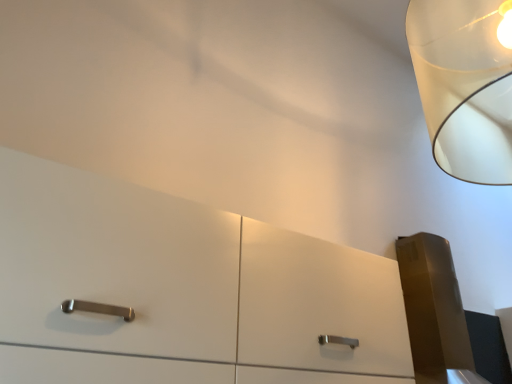
What do you see at coordinates (465, 84) in the screenshot? This screenshot has height=384, width=512. I see `transparent plastic lampshade at upper right` at bounding box center [465, 84].

Image resolution: width=512 pixels, height=384 pixels. I want to click on transparent plastic lampshade at upper right, so click(465, 84).

The image size is (512, 384). Describe the element at coordinates (181, 290) in the screenshot. I see `white glossy dresser at center` at that location.

Identify the location of white glossy dresser at center. The width and height of the screenshot is (512, 384). (181, 290).

I want to click on transparent plastic lampshade at upper right, so click(x=465, y=84).

Does transparent plastic lampshade at upper right appear on the right side of white glossy dresser at center?

Yes.

Relative to white glossy dresser at center, is transparent plastic lampshade at upper right in front or behind?

transparent plastic lampshade at upper right is behind white glossy dresser at center.

Considering the points (426, 74) and (5, 275), which point is behind, point (426, 74) or point (5, 275)?

The point (426, 74) is behind.

From the image's perspective, between transparent plastic lampshade at upper right and white glossy dresser at center, who is located below?

From the image's view, white glossy dresser at center is below.

From a real-world perspective, between transparent plastic lampshade at upper right and white glossy dresser at center, who is vertically lower?

white glossy dresser at center is physically lower.

Is transparent plastic lampshade at upper right thinner than white glossy dresser at center?

In fact, transparent plastic lampshade at upper right might be wider than white glossy dresser at center.

Based on the photo, which of these two, transparent plastic lampshade at upper right or white glossy dresser at center, stands taller?

With more height is transparent plastic lampshade at upper right.

Consider the image. Is transparent plastic lampshade at upper right smaller than white glossy dresser at center?

Yes.

Is transparent plastic lampshade at upper right positioned beyond the bounds of white glossy dresser at center?

That's correct, transparent plastic lampshade at upper right is outside of white glossy dresser at center.

Is transparent plastic lampshade at upper right with white glossy dresser at center?

No.

Could you tell me if transparent plastic lampshade at upper right is turned towards white glossy dresser at center?

No.

This screenshot has height=384, width=512. Identify the location of lamp on the right of white glossy dresser at center. (465, 84).

Considering the positions of objects white glossy dresser at center and transparent plastic lampshade at upper right in the image provided, who is more to the left, white glossy dresser at center or transparent plastic lampshade at upper right?

From the viewer's perspective, white glossy dresser at center appears more on the left side.

Is white glossy dresser at center closer to the viewer compared to transparent plastic lampshade at upper right?

Yes, it is in front of transparent plastic lampshade at upper right.

Is point (156, 246) closer to viewer compared to point (474, 21)?

That is True.

From the image's perspective, is white glossy dresser at center located above or below transparent plastic lampshade at upper right?

From the image's perspective, white glossy dresser at center appears below transparent plastic lampshade at upper right.

From a real-world perspective, is white glossy dresser at center under transparent plastic lampshade at upper right?

Indeed, from a real-world perspective, white glossy dresser at center is positioned beneath transparent plastic lampshade at upper right.

Considering the sizes of objects white glossy dresser at center and transparent plastic lampshade at upper right in the image provided, who is thinner, white glossy dresser at center or transparent plastic lampshade at upper right?

Thinner between the two is white glossy dresser at center.

Can you confirm if white glossy dresser at center is taller than transparent plastic lampshade at upper right?

No, white glossy dresser at center is not taller than transparent plastic lampshade at upper right.

Can you confirm if white glossy dresser at center is bigger than transparent plastic lampshade at upper right?

Yes, white glossy dresser at center is bigger than transparent plastic lampshade at upper right.

Would you say white glossy dresser at center is inside or outside transparent plastic lampshade at upper right?

white glossy dresser at center is located beyond the bounds of transparent plastic lampshade at upper right.

Is white glossy dresser at center touching transparent plastic lampshade at upper right?

No, white glossy dresser at center is not beside transparent plastic lampshade at upper right.

Is white glossy dresser at center facing away from transparent plastic lampshade at upper right?

No, white glossy dresser at center is not facing the opposite direction of transparent plastic lampshade at upper right.

Can you tell me how much white glossy dresser at center and transparent plastic lampshade at upper right differ in facing direction?

They differ by 90 degrees in their facing directions.

How far apart are white glossy dresser at center and transparent plastic lampshade at upper right?

white glossy dresser at center and transparent plastic lampshade at upper right are 2.16 meters apart from each other.

Locate an element on the screen. This screenshot has height=384, width=512. lamp behind the white glossy dresser at center is located at coordinates (465, 84).

You are a GUI agent. You are given a task and a screenshot of the screen. Output one action in this format:
    pyautogui.click(x=<x>, y=<y>)
    Task: Click on the lamp on the right of white glossy dresser at center
    
    Given the screenshot: What is the action you would take?
    465,84

You are a GUI agent. You are given a task and a screenshot of the screen. Output one action in this format:
    pyautogui.click(x=<x>, y=<y>)
    Task: Click on the lamp located behind the white glossy dresser at center
    The width and height of the screenshot is (512, 384).
    Given the screenshot: What is the action you would take?
    pyautogui.click(x=465, y=84)